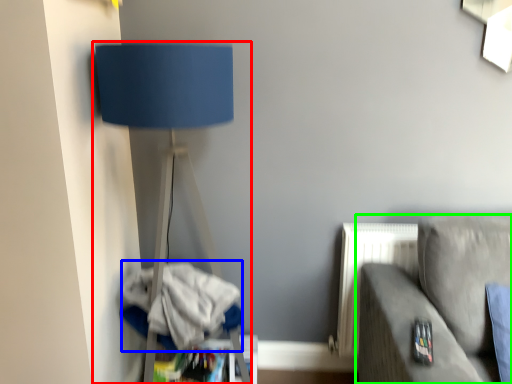
Question: Which object is the closest to the lamp (highlighted by a red box)? Choose among these: laundry (highlighted by a blue box) or studio couch (highlighted by a green box).

Choices:
 (A) laundry
 (B) studio couch

Answer: (A)